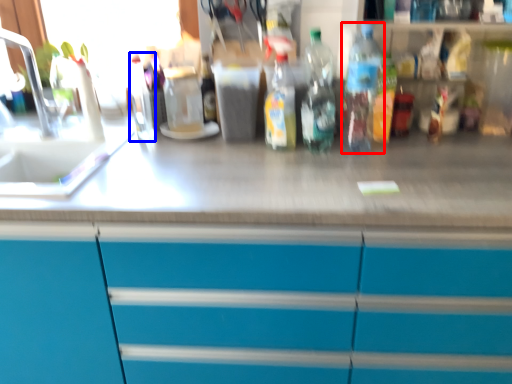
Question: Which of the following is the farthest to the observer, bottle (highlighted by a red box) or bottle (highlighted by a blue box)?

Choices:
 (A) bottle
 (B) bottle

Answer: (B)